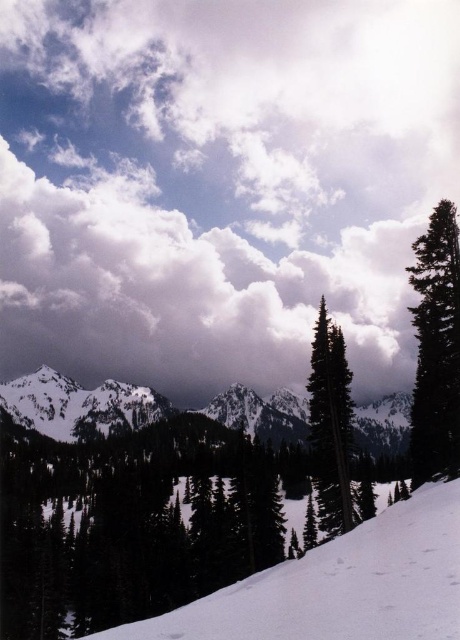
Question: Can you confirm if white fluffy cloud at upper center is positioned to the left of green matte tree at center?

Choices:
 (A) yes
 (B) no

Answer: (B)

Question: Which point is farther to the camera?

Choices:
 (A) (454, 129)
 (B) (325, 481)
 (C) (414, 506)

Answer: (A)

Question: Which of the following is the closest to the observer?

Choices:
 (A) (16, 77)
 (B) (339, 417)

Answer: (B)

Question: Among these objects, which one is nearest to the camera?

Choices:
 (A) white snow at lower left
 (B) white fluffy cloud at upper center
 (C) green matte tree at center
 (D) green matte tree at right

Answer: (A)

Question: Can you confirm if white snow at lower left is thinner than green matte tree at right?

Choices:
 (A) no
 (B) yes

Answer: (A)

Question: Where is white fluffy cloud at upper center located in relation to green matte tree at right in the image?

Choices:
 (A) right
 (B) left

Answer: (B)